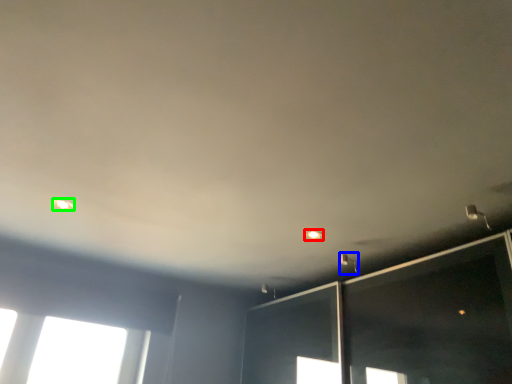
Question: Which is nearer to the dot (highlighted by a red box)? light fixture (highlighted by a blue box) or dot (highlighted by a green box).

Choices:
 (A) light fixture
 (B) dot

Answer: (A)